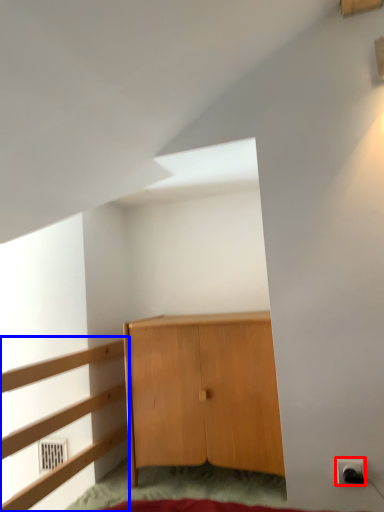
Question: Which object appears closest to the camera in this image, electric outlet (highlighted by a red box) or dresser (highlighted by a blue box)?

Choices:
 (A) electric outlet
 (B) dresser

Answer: (B)